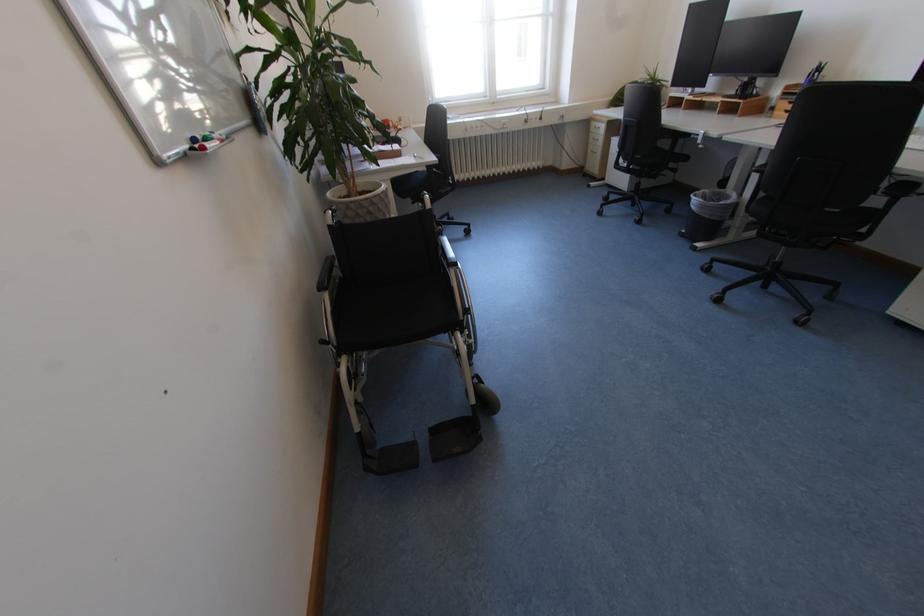
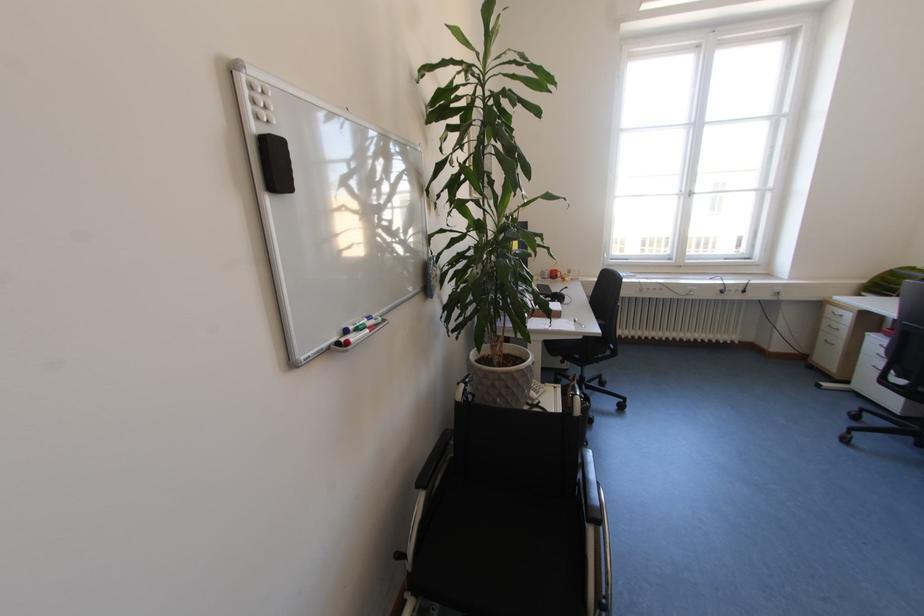
Where in the second image is the point corresponding to (x=207, y=138) from the first image?

(359, 329)